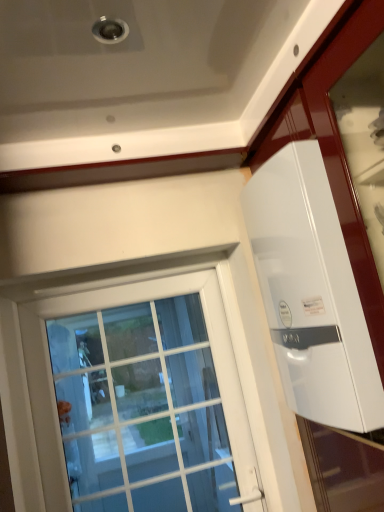
Question: Considering the positions of white glossy water heater at upper right and white glass window at center in the image, is white glossy water heater at upper right bigger or smaller than white glass window at center?

Choices:
 (A) small
 (B) big

Answer: (B)

Question: In terms of height, does white glossy water heater at upper right look taller or shorter compared to white glass window at center?

Choices:
 (A) tall
 (B) short

Answer: (B)

Question: From the image's perspective, is white glossy water heater at upper right located above or below white glass window at center?

Choices:
 (A) below
 (B) above

Answer: (B)

Question: From the image's perspective, relative to white glossy water heater at upper right, is white glass window at center above or below?

Choices:
 (A) below
 (B) above

Answer: (A)

Question: From a real-world perspective, is white glass window at center positioned above or below white glossy water heater at upper right?

Choices:
 (A) below
 (B) above

Answer: (A)

Question: In terms of size, does white glass window at center appear bigger or smaller than white glossy water heater at upper right?

Choices:
 (A) big
 (B) small

Answer: (B)

Question: Which is correct: white glass window at center is inside white glossy water heater at upper right, or outside of it?

Choices:
 (A) outside
 (B) inside

Answer: (A)